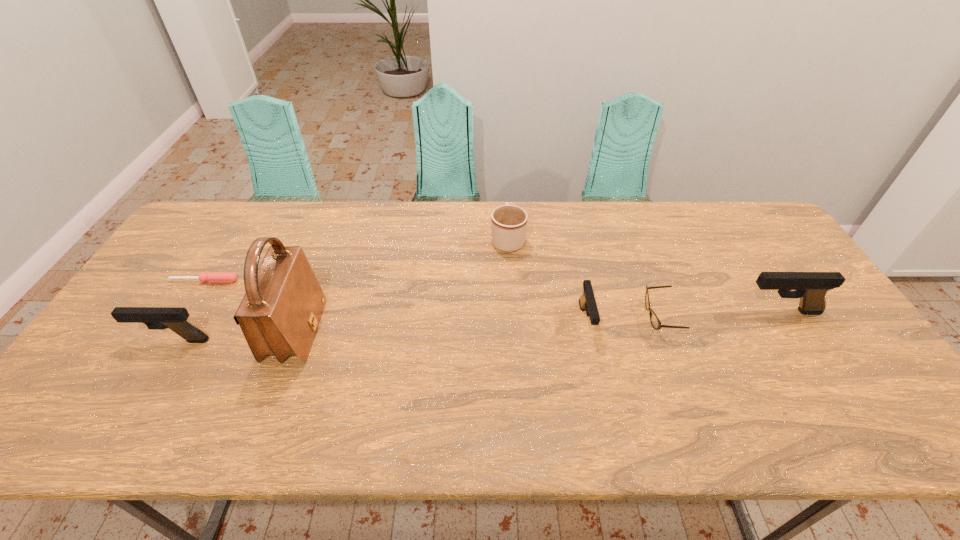
This screenshot has width=960, height=540. Identify the location of vacant area at the far edge of the desktop. (695, 201).

Locate an element on the screen. This screenshot has height=540, width=960. vacant space at the near edge of the desktop is located at coordinates (456, 376).

This screenshot has height=540, width=960. In the image, there is a desktop. Find the location of `free space at the left edge`. free space at the left edge is located at coordinates (192, 281).

Locate an element on the screen. The image size is (960, 540). vacant space at the right edge of the desktop is located at coordinates (759, 290).

This screenshot has width=960, height=540. In the image, there is a desktop. What are the coordinates of `vacant space at the near right corner` in the screenshot? It's located at (844, 383).

This screenshot has width=960, height=540. What are the coordinates of `free space between the fourth object from left to right and the second tallest pistol` in the screenshot? It's located at click(340, 289).

Identify the location of vacant point located between the shortest object and the third object from right to left. (396, 301).

Where is `free point between the second farthest object and the fourth object from right to left`? This screenshot has height=540, width=960. free point between the second farthest object and the fourth object from right to left is located at coordinates (356, 260).

Find the location of a particular element. free space between the spectacles and the second pistol from right to left is located at coordinates (623, 319).

The height and width of the screenshot is (540, 960). Identify the location of empty space that is in between the sixth shortest object and the third object from right to left. (683, 316).